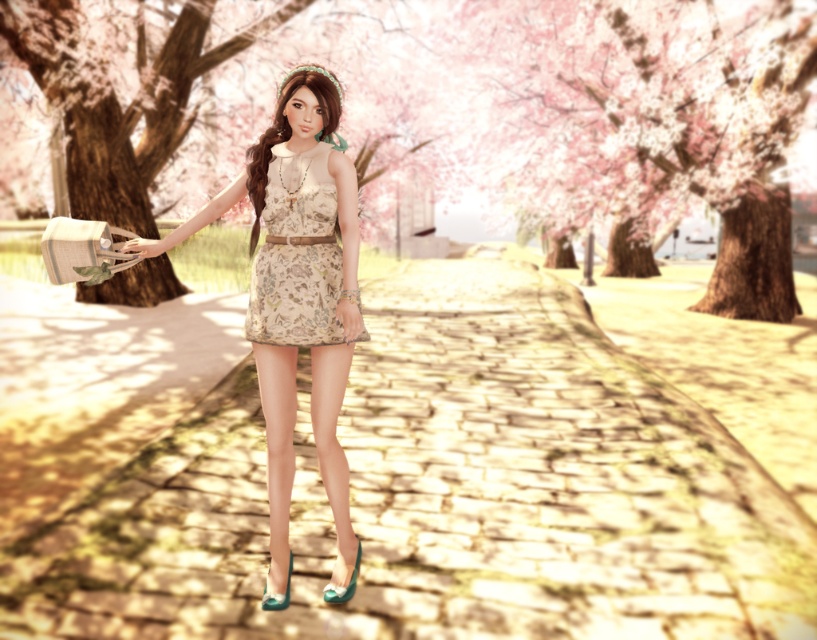
Who is positioned more to the right, yellow stone pavement at center or matte floral dress at center?

Positioned to the right is yellow stone pavement at center.

Identify the location of yellow stone pavement at center. (440, 493).

Does matte floral dress at center appear over brown textured tree at center?

Actually, matte floral dress at center is below brown textured tree at center.

This screenshot has height=640, width=817. What are the coordinates of `matte floral dress at center` in the screenshot? It's located at (298, 301).

This screenshot has height=640, width=817. Identify the location of matte floral dress at center. (298, 301).

Does brown wood tree at center have a larger size compared to brown textured tree at center?

Yes.

Identify the location of brown wood tree at center. This screenshot has height=640, width=817. (480, 115).

Is point (329, 51) more distant than point (87, 196)?

No, it is not.

At what (x,y) coordinates should I click in order to perform the action: click on brown wood tree at center. Please return your answer as a coordinate pair (x, y). The width and height of the screenshot is (817, 640). Looking at the image, I should click on (480, 115).